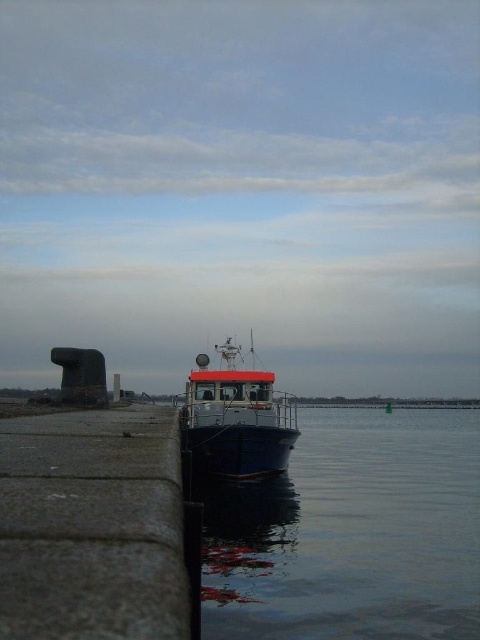
You are standing on the pier and looking at the scene. Which object, the smooth blue water at center or the blue metallic boat at center, is nearer to you?

The smooth blue water at center is closer to the viewer than the blue metallic boat at center.